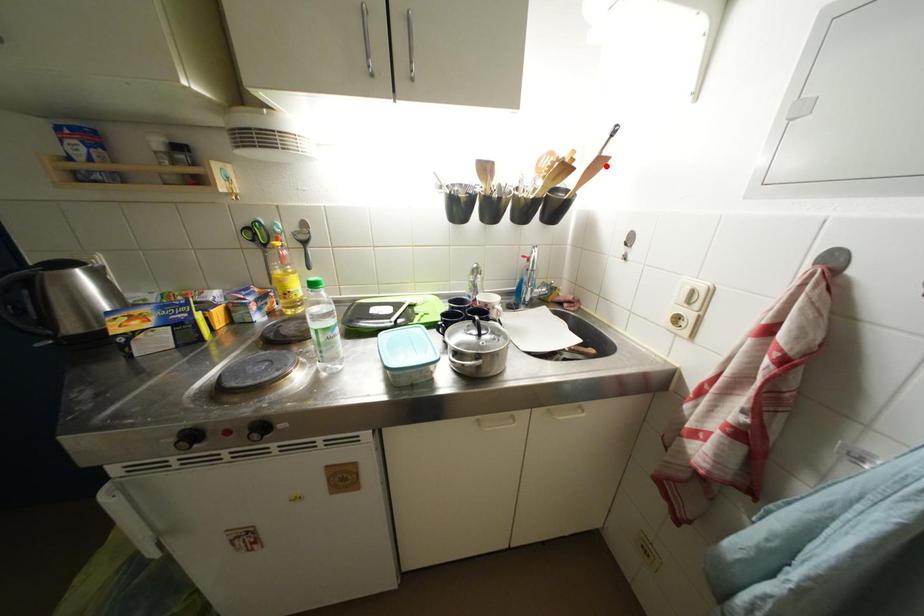
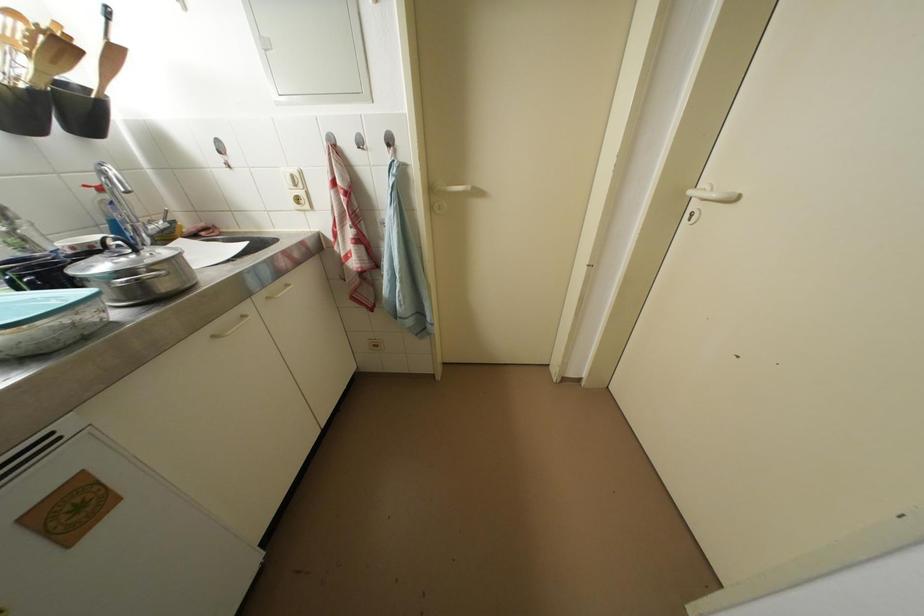
Question: I am providing you with two images of the same scene from different viewpoints. Given a red point in image1, look at the same physical point in image2. Is it:

Choices:
 (A) Closer to the viewpoint
 (B) Farther from the viewpoint

Answer: (B)